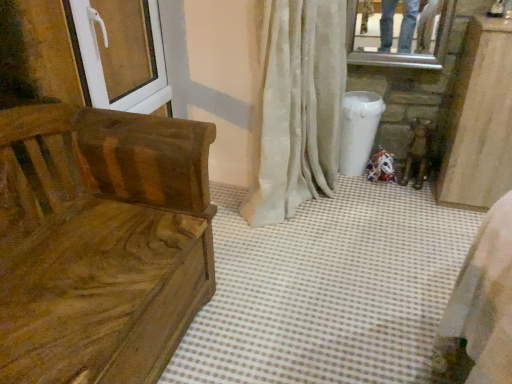
Question: Can you confirm if wooden bench at left is positioned to the right of white textured curtain at center?

Choices:
 (A) yes
 (B) no

Answer: (B)

Question: From the image's perspective, does wooden bench at left appear lower than white textured curtain at center?

Choices:
 (A) no
 (B) yes

Answer: (B)

Question: Is white textured curtain at center surrounded by wooden bench at left?

Choices:
 (A) yes
 (B) no

Answer: (B)

Question: From the image's perspective, is wooden bench at left located above white textured curtain at center?

Choices:
 (A) yes
 (B) no

Answer: (B)

Question: Does wooden bench at left have a larger size compared to white textured curtain at center?

Choices:
 (A) yes
 (B) no

Answer: (A)

Question: Considering their positions, is white textured curtain at center located in front of or behind white plastic screen door at upper left?

Choices:
 (A) behind
 (B) front

Answer: (B)

Question: In the image, is white textured curtain at center on the left side or the right side of white plastic screen door at upper left?

Choices:
 (A) left
 (B) right

Answer: (B)

Question: From the image's perspective, is white textured curtain at center above or below white plastic screen door at upper left?

Choices:
 (A) below
 (B) above

Answer: (A)

Question: From a real-world perspective, relative to white plastic screen door at upper left, is white textured curtain at center vertically above or below?

Choices:
 (A) above
 (B) below

Answer: (B)

Question: Is white plastic screen door at upper left taller or shorter than white textured curtain at center?

Choices:
 (A) short
 (B) tall

Answer: (A)

Question: Looking at the image, does white plastic screen door at upper left seem bigger or smaller compared to white textured curtain at center?

Choices:
 (A) big
 (B) small

Answer: (B)

Question: Choose the correct answer: Is white plastic screen door at upper left inside white textured curtain at center or outside it?

Choices:
 (A) outside
 (B) inside

Answer: (A)

Question: From the image's perspective, is white plastic screen door at upper left located above or below white textured curtain at center?

Choices:
 (A) above
 (B) below

Answer: (A)

Question: In terms of height, does white plastic screen door at upper left look taller or shorter compared to wooden bench at left?

Choices:
 (A) short
 (B) tall

Answer: (A)

Question: Relative to wooden bench at left, is white plastic screen door at upper left in front or behind?

Choices:
 (A) front
 (B) behind

Answer: (B)